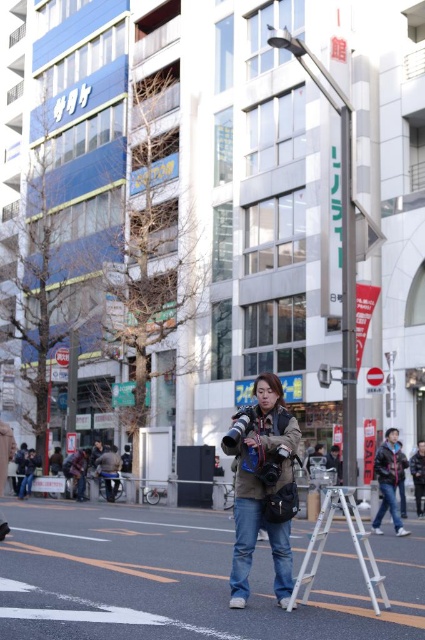
Is silver metallic ladder at center bigger than dark blue jacket at center?

No, silver metallic ladder at center is not bigger than dark blue jacket at center.

Who is more forward, (362, 564) or (391, 433)?

Point (362, 564)

This screenshot has width=425, height=640. I want to click on silver metallic ladder at center, so click(x=353, y=545).

From the picture: Who is more forward, [243,525] or [377,568]?

Point [243,525] is more forward.

Locate an element on the screen. This screenshot has height=640, width=425. denim jacket at center is located at coordinates (263, 484).

I want to click on denim jacket at center, so click(x=263, y=484).

Can you confirm if denim jacket at center is positioned to the left of dark blue jacket at center?

Indeed, denim jacket at center is positioned on the left side of dark blue jacket at center.

Is denim jacket at center positioned at the back of dark blue jacket at center?

No.

Which is in front, point (292, 481) or point (385, 456)?

Positioned in front is point (292, 481).

This screenshot has height=640, width=425. Identify the location of denim jacket at center. [263, 484].